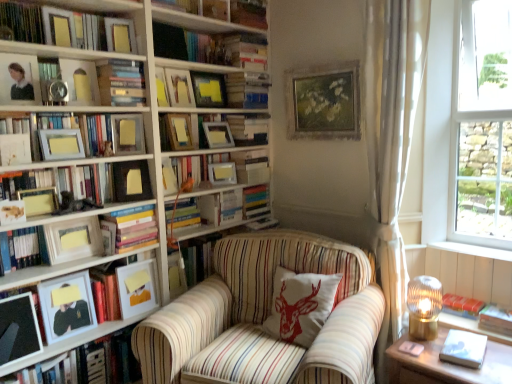
Where is `vacant region under white paper book at lower right, the 18th book positioned from the top (from a real-world perspective)`? The width and height of the screenshot is (512, 384). vacant region under white paper book at lower right, the 18th book positioned from the top (from a real-world perspective) is located at coordinates (459, 356).